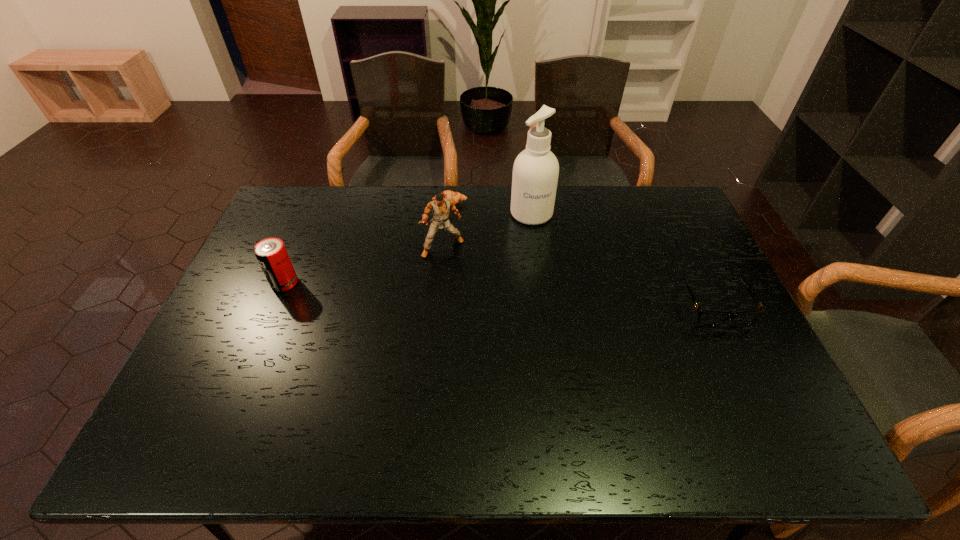
Identify the location of object that is the third closest one to the third farthest object. (271, 253).

At what (x,y) coordinates should I click in order to perform the action: click on free space that satisfies the following two spatial constraints: 1. on the back side of the shortest object; 2. on the left side of the third farthest object. Please return your answer as a coordinate pair (x, y). The image size is (960, 540). Looking at the image, I should click on (446, 203).